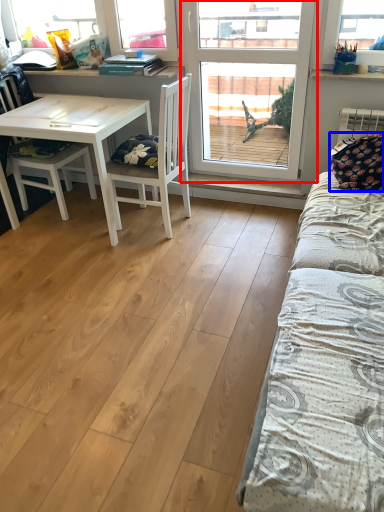
Question: Which point is closer to the camera, window (highlighted by a red box) or pillow (highlighted by a blue box)?

Choices:
 (A) window
 (B) pillow

Answer: (B)